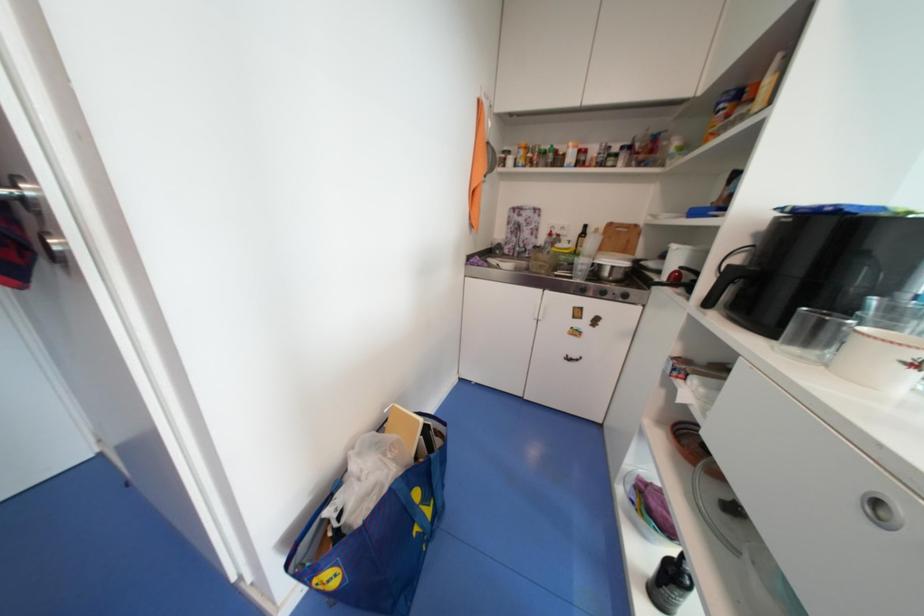
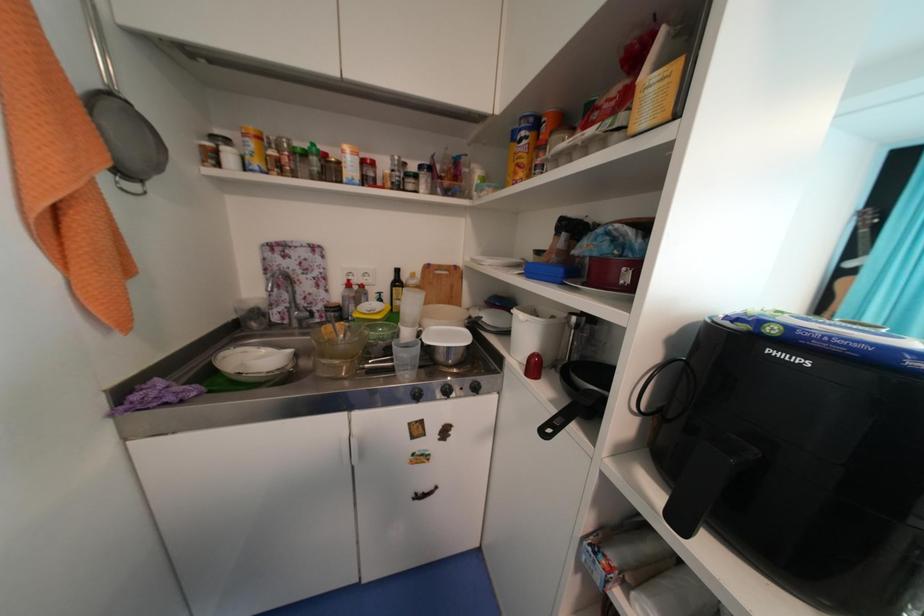
Question: The camera is either moving clockwise (left) or counter-clockwise (right) around the object. The first image is from the beginning of the video and the second image is from the end. Is the camera moving left or right when shooting the video?

Choices:
 (A) Left
 (B) Right

Answer: (A)